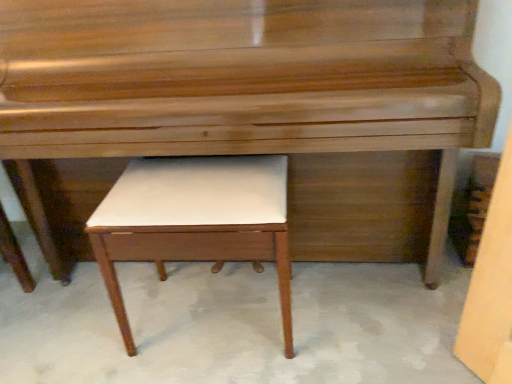
Question: Is glossy wood piano at center with white leather stool at center?

Choices:
 (A) yes
 (B) no

Answer: (B)

Question: Does glossy wood piano at center have a lesser height compared to white leather stool at center?

Choices:
 (A) yes
 (B) no

Answer: (B)

Question: Does glossy wood piano at center have a larger size compared to white leather stool at center?

Choices:
 (A) no
 (B) yes

Answer: (B)

Question: Considering the relative sizes of glossy wood piano at center and white leather stool at center in the image provided, is glossy wood piano at center smaller than white leather stool at center?

Choices:
 (A) no
 (B) yes

Answer: (A)

Question: Is glossy wood piano at center taller than white leather stool at center?

Choices:
 (A) yes
 (B) no

Answer: (A)

Question: Does glossy wood piano at center appear on the right side of white leather stool at center?

Choices:
 (A) no
 (B) yes

Answer: (B)

Question: Is white leather stool at center closer to camera compared to glossy wood piano at center?

Choices:
 (A) yes
 (B) no

Answer: (B)

Question: Is white leather stool at center thinner than glossy wood piano at center?

Choices:
 (A) no
 (B) yes

Answer: (B)

Question: Considering the relative positions of white leather stool at center and glossy wood piano at center in the image provided, is white leather stool at center behind glossy wood piano at center?

Choices:
 (A) no
 (B) yes

Answer: (B)

Question: Can you confirm if white leather stool at center is positioned to the left of glossy wood piano at center?

Choices:
 (A) yes
 (B) no

Answer: (A)

Question: Would you say white leather stool at center contains glossy wood piano at center?

Choices:
 (A) no
 (B) yes

Answer: (A)

Question: From a real-world perspective, does white leather stool at center stand above glossy wood piano at center?

Choices:
 (A) no
 (B) yes

Answer: (A)

Question: From a real-world perspective, relative to glossy wood piano at center, is white leather stool at center vertically above or below?

Choices:
 (A) above
 (B) below

Answer: (B)